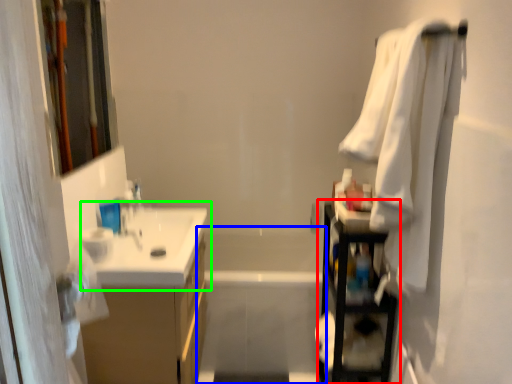
Question: Which object is the farthest from shelf (highlighted by a red box)? Choose among these: bath (highlighted by a blue box) or sink (highlighted by a green box).

Choices:
 (A) bath
 (B) sink

Answer: (B)